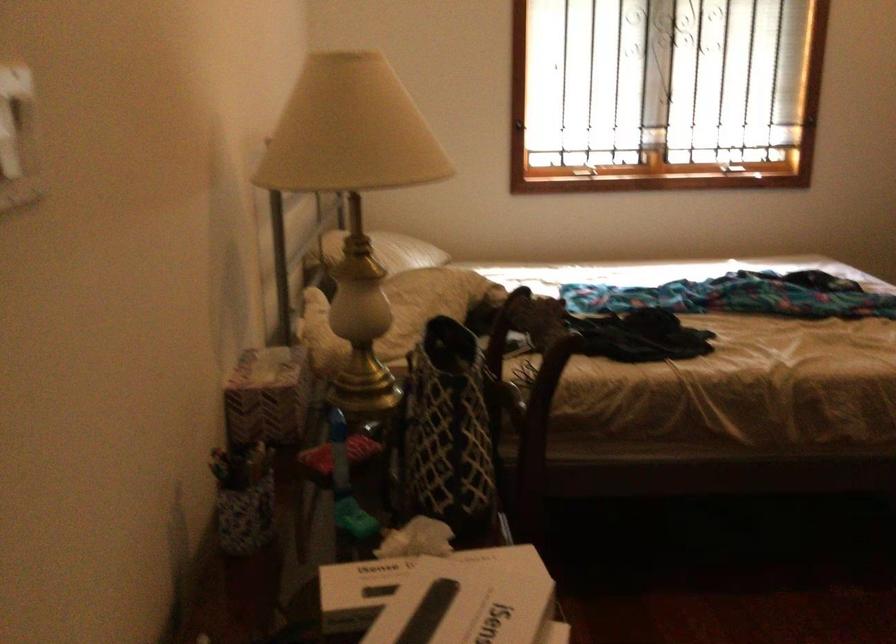
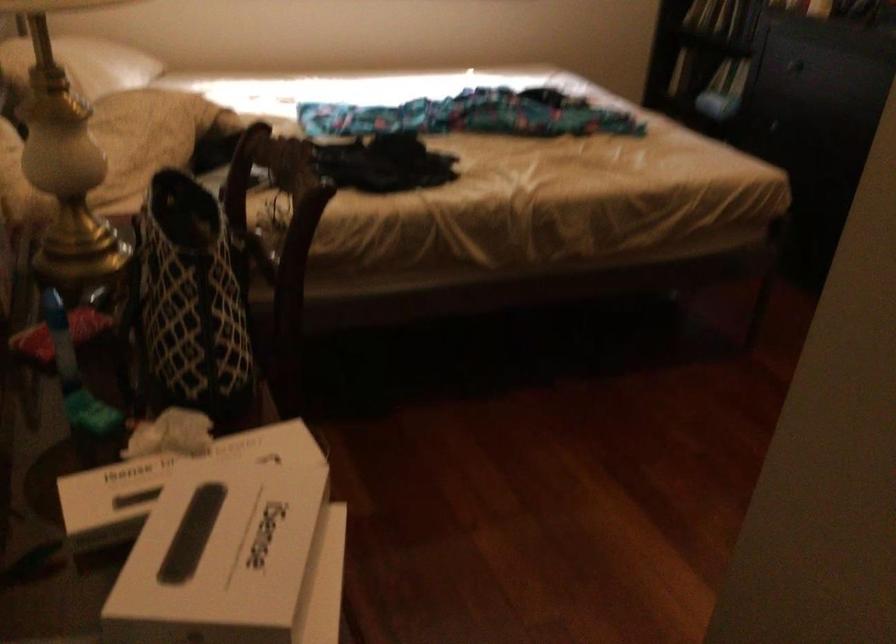
Locate, in the second image, the point that corresponds to the point at 406,571 in the first image.

(168, 477)